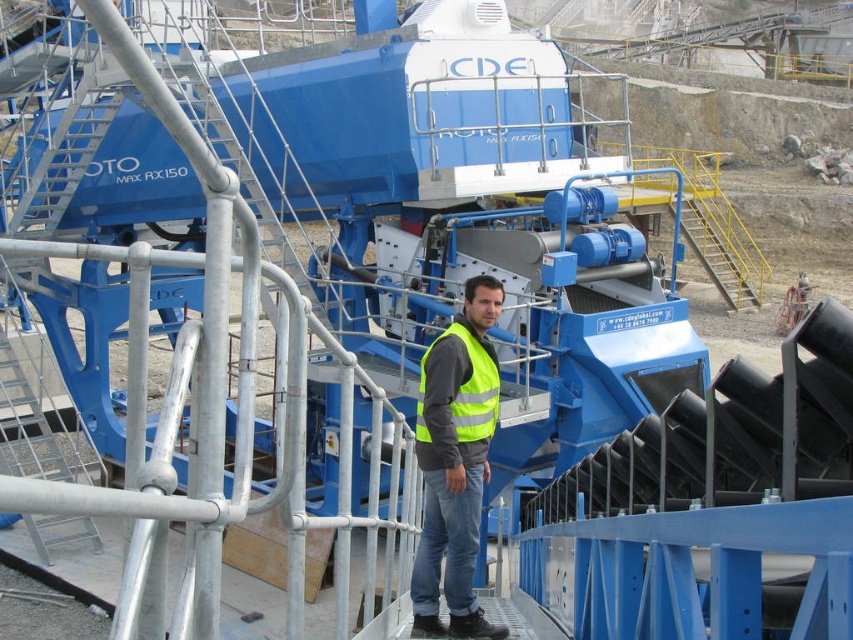
You are an inspector checking safety equipment on the platform. You notice two safety vests at the center. Which one is positioned lower between the high visibility yellow vest at center and the yellow reflective safety vest at center?

The high visibility yellow vest at center is positioned lower than the yellow reflective safety vest at center.

You are an inspector checking safety equipment on the CDE OTO MAX RX150 machine. You notice two safety vests at the center of the platform. Can you determine if the high visibility yellow vest at center and the yellow reflective safety vest at center are the same item?

The distance between the high visibility yellow vest at center and the yellow reflective safety vest at center is 37.56 centimeters, which means they are separate items and not the same vest.

You are a safety inspector checking the equipment on the platform. You notice two vests at the center. Which one is wider, the high visibility yellow vest at center or the yellow reflective safety vest at center?

The high visibility yellow vest at center might be wider than yellow reflective safety vest at center according to the description.